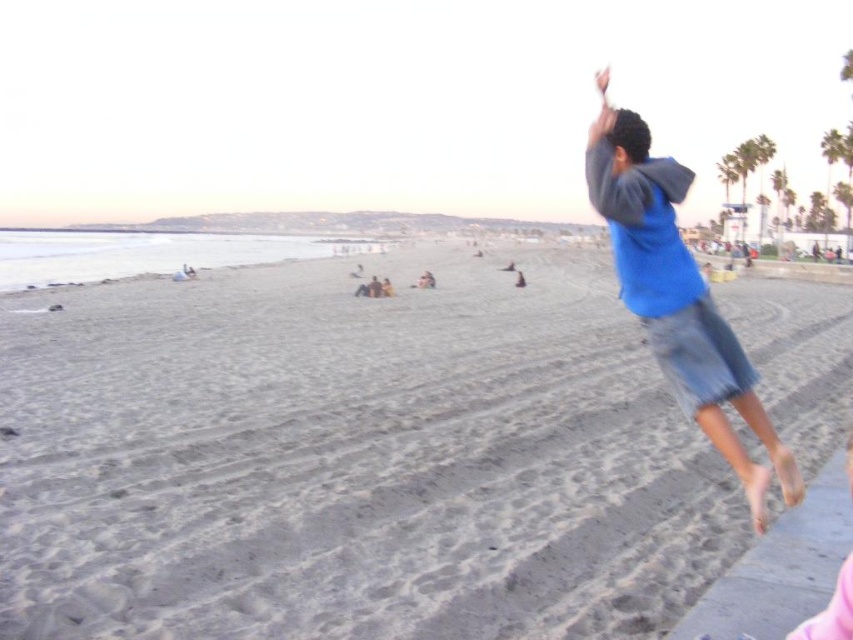
You are standing on the beach and want to reach the point marked as point [654,385]. If you walk straight ahead, how far will you have to walk to reach that point?

The point [654,385] is 10.44 meters away from the viewer, so you will have to walk 10.44 meters straight ahead to reach it.

You are standing on the paved area where the person jumped from and want to walk to the gray sand at lower center. According to the coordinates provided, which direction should you move relative to your current position?

The gray sand at lower center is located at point coordinates, so you should move towards the lower center direction from your current position on the paved area.

You are standing on the gray sand at lower center and want to throw a ball to someone wearing the blue cotton shirt at upper right. Considering the height difference between the two locations, will the ball need to be thrown higher or lower to reach them?

The gray sand at lower center is higher than the blue cotton shirt at upper right, so you should throw the ball lower to reach them.